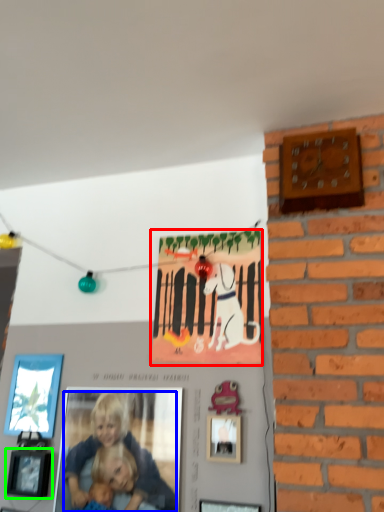
Question: Which is farther away from postcard (highlighted by a red box)? person (highlighted by a blue box) or picture frame (highlighted by a green box)?

Choices:
 (A) person
 (B) picture frame

Answer: (B)